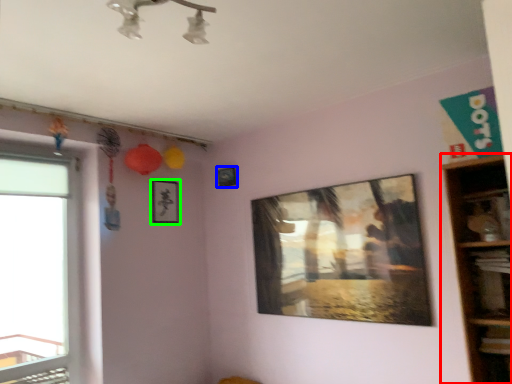
Question: Which object is the closest to the shelf (highlighted by a red box)? Choose among these: picture frame (highlighted by a blue box) or picture frame (highlighted by a green box).

Choices:
 (A) picture frame
 (B) picture frame

Answer: (A)